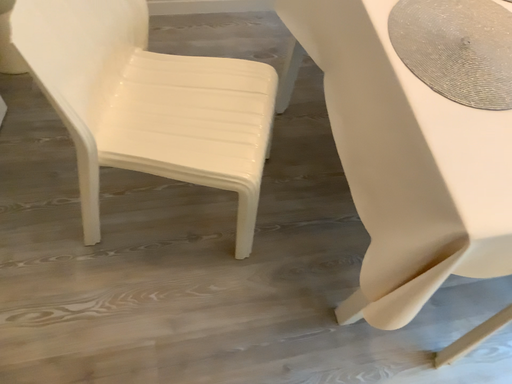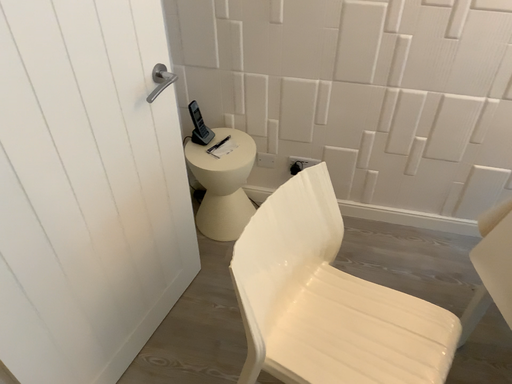
Question: How did the camera likely rotate when shooting the video?

Choices:
 (A) rotated upward
 (B) rotated downward

Answer: (A)